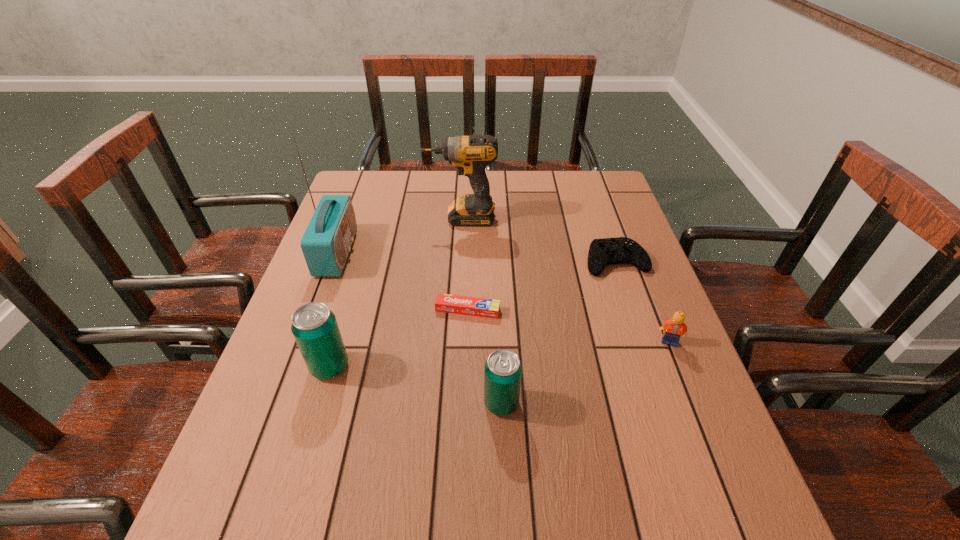
Locate an element on the screen. The height and width of the screenshot is (540, 960). vacant region that satisfies the following two spatial constraints: 1. on the back side of the fourth shortest object; 2. on the right side of the second shortest object is located at coordinates (495, 261).

I want to click on free spot that satisfies the following two spatial constraints: 1. with the drill bit of the fourth nearest object facing forward; 2. on the right side of the second tallest object, so click(x=456, y=310).

Where is `free space that satisfies the following two spatial constraints: 1. on the back side of the toothpaste; 2. on the left side of the second shortest object`? free space that satisfies the following two spatial constraints: 1. on the back side of the toothpaste; 2. on the left side of the second shortest object is located at coordinates (468, 261).